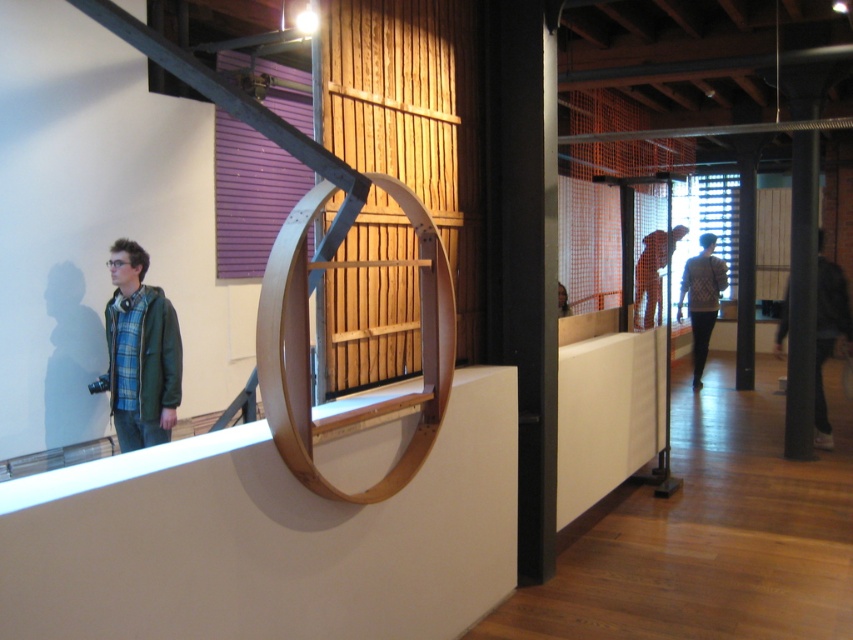
You are standing in the art gallery and notice two points marked on the wall. The first point is at coordinates point (115,360) and the second is at point (711,308). Which point is closer to you?

Point (115,360) is closer to the viewer than point (711,308).

You are an art critic standing in the gallery and see the green matte jacket at left and the knit sweater at center. Which one is positioned closer to the entrance of the gallery?

The green matte jacket at left is positioned closer to the entrance of the gallery because it is to the left of the knit sweater at center, implying it is nearer to the entrance direction.

You are an art critic standing in the gallery and see the green matte jacket at left and the orange fabric at center. Which object is located to the right of the other?

The orange fabric at center is to the right of the green matte jacket at left.